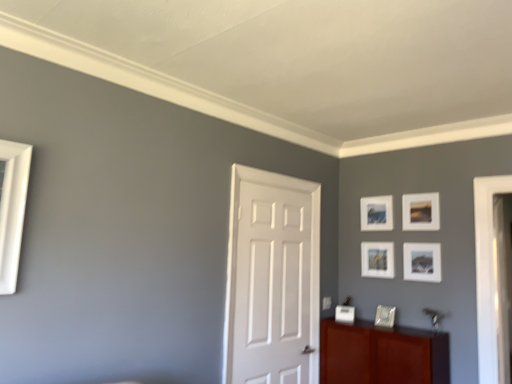
Question: Considering the positions of matte white picture frame at center, which is counted as the fourth picture frame, starting from the top, and matte white picture frame at upper right, the third picture frame when ordered from top to bottom, in the image, is matte white picture frame at center, which is counted as the fourth picture frame, starting from the top, taller or shorter than matte white picture frame at upper right, the third picture frame when ordered from top to bottom,?

Choices:
 (A) tall
 (B) short

Answer: (A)

Question: Considering the positions of matte white picture frame at center, which ranks as the 2th picture frame in bottom-to-top order, and matte white picture frame at upper right, the third picture frame when ordered from top to bottom, in the image, is matte white picture frame at center, which ranks as the 2th picture frame in bottom-to-top order, wider or thinner than matte white picture frame at upper right, the third picture frame when ordered from top to bottom,?

Choices:
 (A) wide
 (B) thin

Answer: (A)

Question: Which object is positioned farthest from the mahogany wood cabinet at lower right?

Choices:
 (A) white matte door at center
 (B) matte white picture frame at upper right, positioned as the first picture frame in top-to-bottom order
 (C) matte white picture frame at lower center, the first picture frame ordered from the bottom
 (D) matte white picture frame at center, which ranks as the 2th picture frame in bottom-to-top order
 (E) matte white picture frame at upper right, which appears as the third picture frame when ordered from the bottom

Answer: (B)

Question: Estimate the real-world distances between objects in this image. Which object is closer to the white matte door at center?

Choices:
 (A) matte white picture frame at upper right, placed as the fifth picture frame when sorted from bottom to top
 (B) matte white picture frame at upper right, which appears as the third picture frame when ordered from the bottom
 (C) mahogany wood cabinet at lower right
 (D) white matte picture frame at upper right, which appears as the fourth picture frame when ordered from the bottom
 (E) matte white picture frame at center, which ranks as the 2th picture frame in bottom-to-top order

Answer: (C)